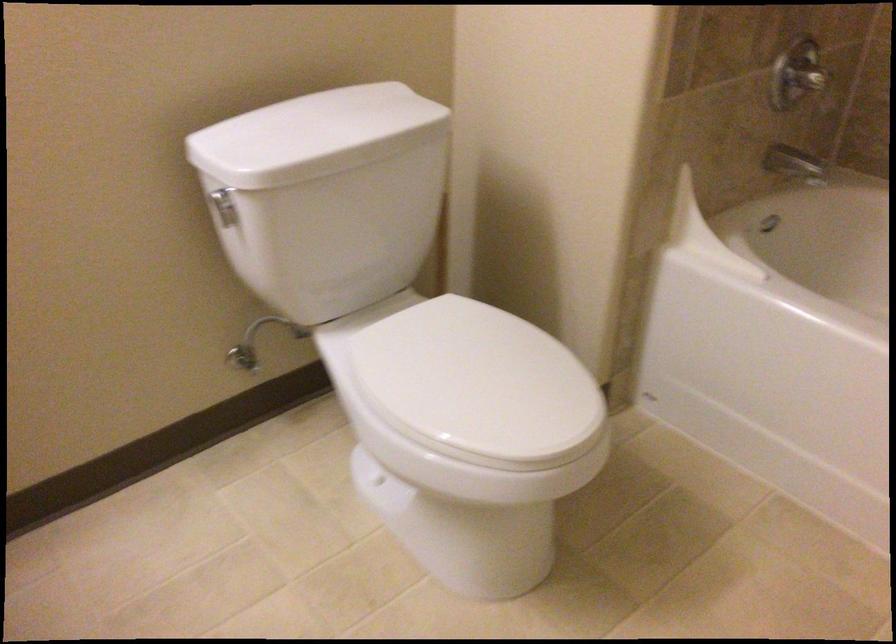
What do you see at coordinates (366, 109) in the screenshot? This screenshot has height=644, width=896. I see `the white tank lid` at bounding box center [366, 109].